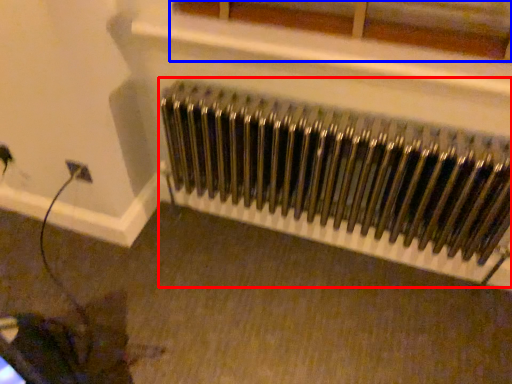
Question: Which object is further to the camera taking this photo, radiator (highlighted by a red box) or window (highlighted by a blue box)?

Choices:
 (A) radiator
 (B) window

Answer: (A)